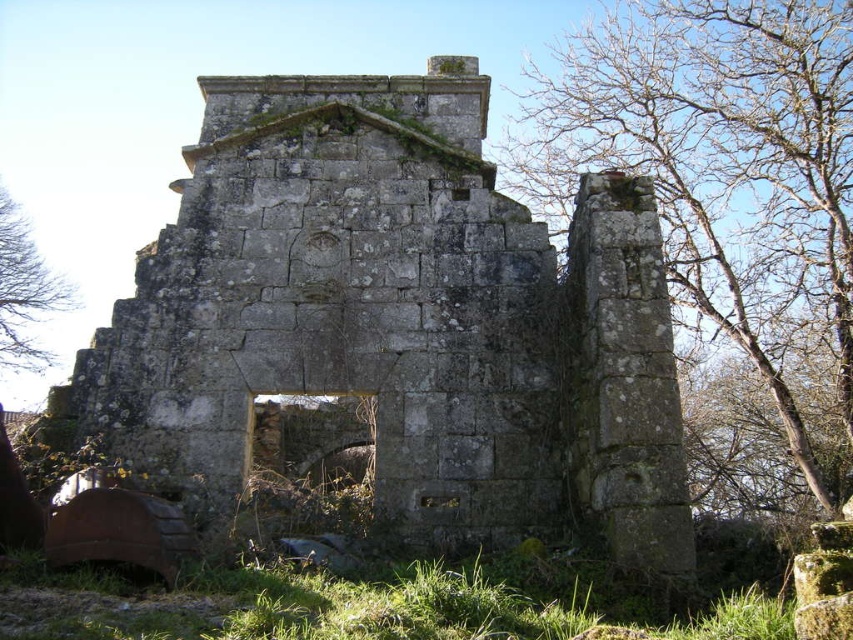
Question: Which object appears farthest from the camera in this image?

Choices:
 (A) gray stone ruins at center
 (B) brown wood tree at left
 (C) green mossy stone wall at upper center

Answer: (B)

Question: Can you confirm if green mossy stone wall at upper center is positioned to the left of brown wood tree at left?

Choices:
 (A) yes
 (B) no

Answer: (B)

Question: Can you confirm if gray stone ruins at center is positioned to the right of brown wood tree at left?

Choices:
 (A) yes
 (B) no

Answer: (A)

Question: Is gray stone ruins at center above green mossy stone wall at upper center?

Choices:
 (A) no
 (B) yes

Answer: (A)

Question: Which object is the closest to the gray stone ruins at center?

Choices:
 (A) brown wood tree at left
 (B) green mossy stone wall at upper center

Answer: (B)

Question: Which object appears farthest from the camera in this image?

Choices:
 (A) gray stone ruins at center
 (B) brown wood tree at left

Answer: (B)